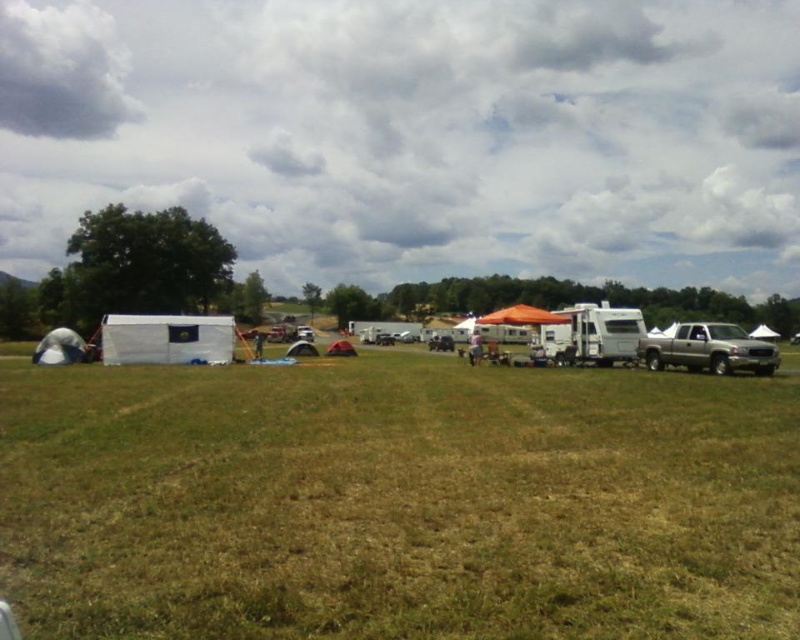
Can you confirm if white fabric tent at lower left is positioned above red fabric tent at center?

Yes.

Image resolution: width=800 pixels, height=640 pixels. Describe the element at coordinates (60, 348) in the screenshot. I see `white fabric tent at lower left` at that location.

Image resolution: width=800 pixels, height=640 pixels. In order to click on white fabric tent at lower left in this screenshot , I will do `click(60, 348)`.

Is point (124, 364) farther from viewer compared to point (76, 352)?

That is False.

Does point (154, 330) lie in front of point (44, 342)?

That is True.

Find the location of a particular element. The image size is (800, 640). white canvas tent at left is located at coordinates (166, 339).

Is white canvas tent at lower left positioned behind white canvas tent at left?

No, it is not.

Is point (684, 337) in front of point (120, 358)?

Yes, point (684, 337) is in front of point (120, 358).

You are a GUI agent. You are given a task and a screenshot of the screen. Output one action in this format:
    pyautogui.click(x=<x>, y=<y>)
    Task: Click on the white canvas tent at lower left
    The image size is (800, 640).
    Given the screenshot: What is the action you would take?
    pyautogui.click(x=640, y=339)